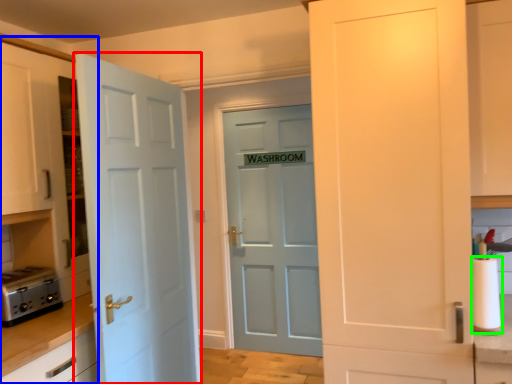
Question: Which is farther away from door (highlighted by a red box)? dresser (highlighted by a blue box) or paper towel (highlighted by a green box)?

Choices:
 (A) dresser
 (B) paper towel

Answer: (B)